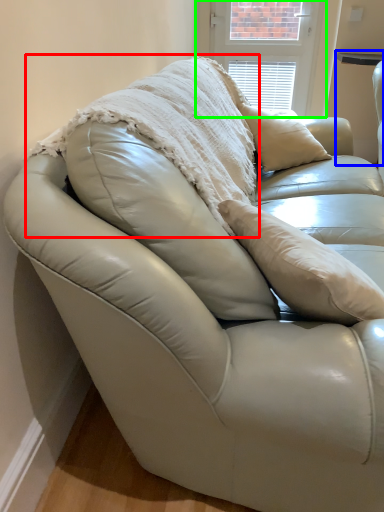
Question: Which object is the farthest from blanket (highlighted by a red box)? Choose among these: table (highlighted by a blue box) or window screen (highlighted by a green box).

Choices:
 (A) table
 (B) window screen

Answer: (A)